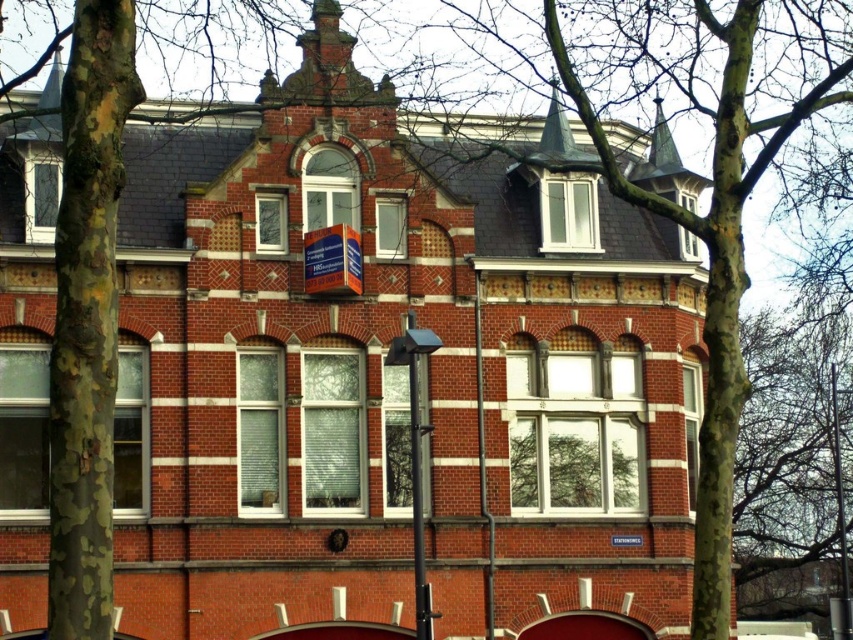
You are standing in front of the red brick building and notice two poles. The black metal pole at center and the metallic pole at right. Which pole is closer to you?

The black metal pole at center is closer to the viewer than the metallic pole at right.

You are a city planner assessing the placement of poles in front of a historical building. You notice the black metal pole at center and the metallic pole at right. Which pole is shorter?

The black metal pole at center is shorter than the metallic pole at right.

You are standing in front of a historical red brick building with two large trees in the foreground. You want to place a small bench at the point labeled point (486, 582). Considering the distance from where you are standing to that point, is the bench likely to be within the immediate vicinity of the building or further away from it?

The point (486, 582) is 73.94 meters from the viewer, so the bench would be placed far away from the building, not within the immediate vicinity.